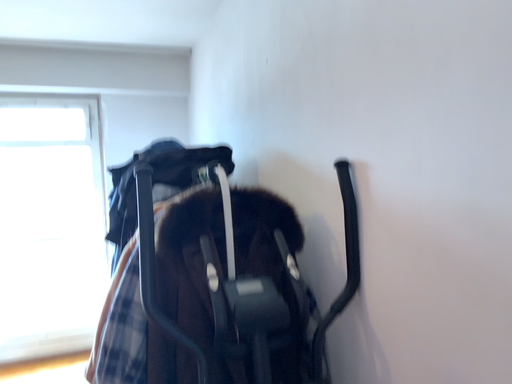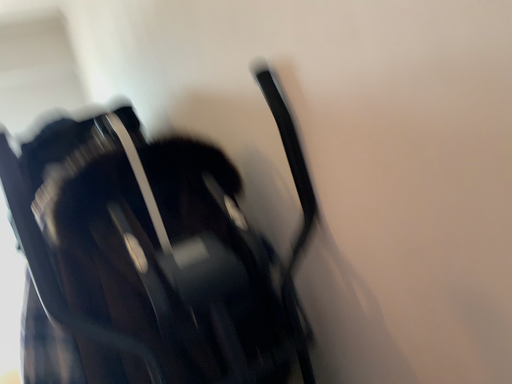
Question: How did the camera likely rotate when shooting the video?

Choices:
 (A) rotated right
 (B) rotated left

Answer: (A)